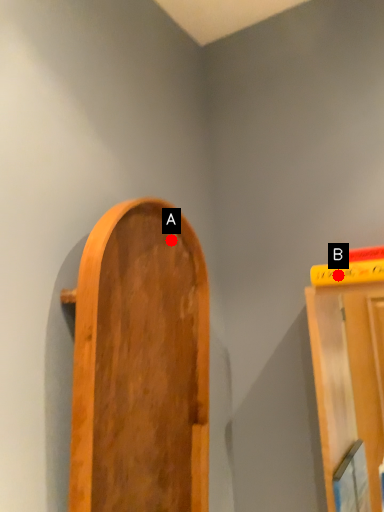
Question: Two points are circled on the image, labeled by A and B beside each circle. Which point appears farthest from the camera in this image?

Choices:
 (A) A is further
 (B) B is further

Answer: (A)